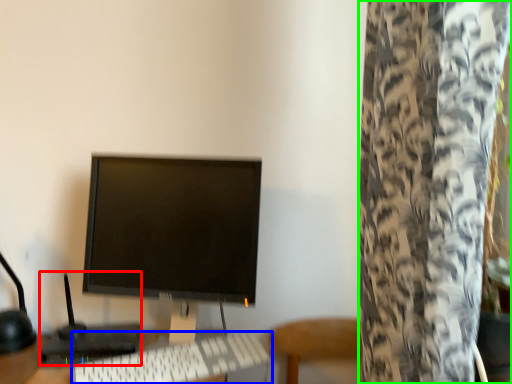
Question: Based on their relative distances, which object is nearer to computer (highlighted by a red box)? Choose from computer keyboard (highlighted by a blue box) and curtain (highlighted by a green box).

Choices:
 (A) computer keyboard
 (B) curtain

Answer: (A)